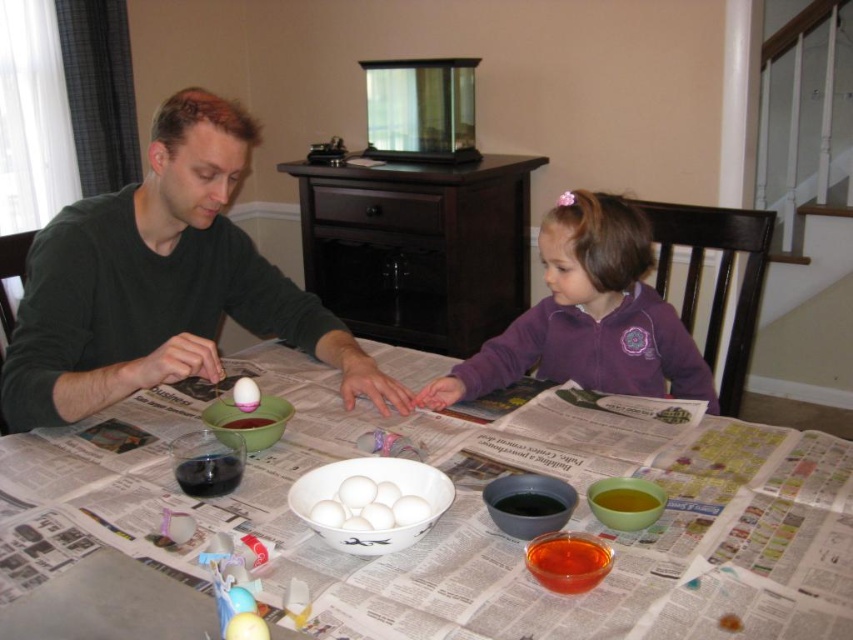
Who is higher up, white glossy bowl at center or white glossy egg at center?

white glossy bowl at center

Who is shorter, white glossy bowl at center or white glossy egg at center?

white glossy egg at center

Consider the image. Measure the distance between white glossy bowl at center and camera.

white glossy bowl at center and camera are 27.74 inches apart.

Image resolution: width=853 pixels, height=640 pixels. Find the location of `white glossy bowl at center`. white glossy bowl at center is located at coordinates (477, 502).

Find the location of a particular element. This screenshot has width=853, height=640. white glossy eggs at center is located at coordinates (368, 506).

Find the location of a particular element. This screenshot has width=853, height=640. white glossy eggs at center is located at coordinates (368, 506).

Between matte black egg at left and pink matte egg at center, which one has less height?

With less height is pink matte egg at center.

Between point (201, 240) and point (258, 394), which one is positioned in front?

Point (258, 394) is in front.

This screenshot has width=853, height=640. I want to click on matte black egg at left, so click(x=161, y=284).